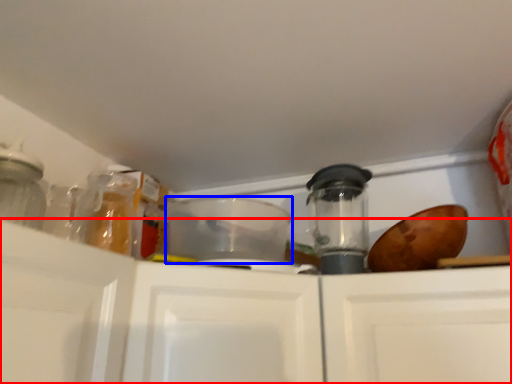
Question: Which point is further to the camera, cabinetry (highlighted by a red box) or appliance (highlighted by a blue box)?

Choices:
 (A) cabinetry
 (B) appliance

Answer: (B)